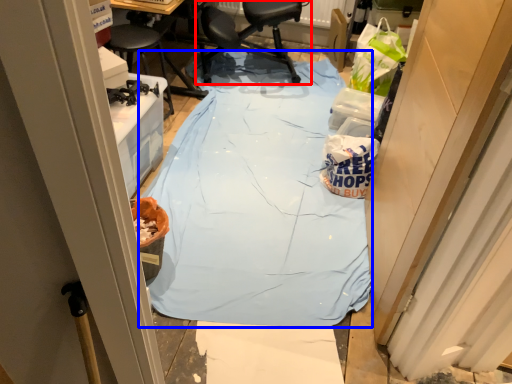
Question: Which point is further to the camera, chair (highlighted by a red box) or tablecloth (highlighted by a blue box)?

Choices:
 (A) chair
 (B) tablecloth

Answer: (A)